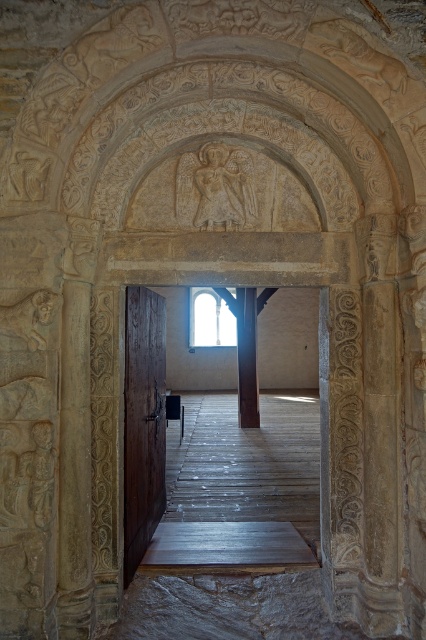
Question: Which point is farther from the camera taking this photo?

Choices:
 (A) (221, 340)
 (B) (238, 392)
 (C) (123, 492)

Answer: (A)

Question: Is wooden floor at center closer to camera compared to dark wood pillar at center?

Choices:
 (A) yes
 (B) no

Answer: (A)

Question: Which object appears farthest from the camera in this image?

Choices:
 (A) dark wood pillar at center
 (B) wooden floor at center

Answer: (A)

Question: Which object appears closest to the camera in this image?

Choices:
 (A) dark wood pillar at center
 (B) wooden floor at center

Answer: (B)

Question: Is dark wood pillar at center bigger than clear glass window at center?

Choices:
 (A) no
 (B) yes

Answer: (A)

Question: Is the position of brown wooden door at center less distant than that of dark wood pillar at center?

Choices:
 (A) no
 (B) yes

Answer: (B)